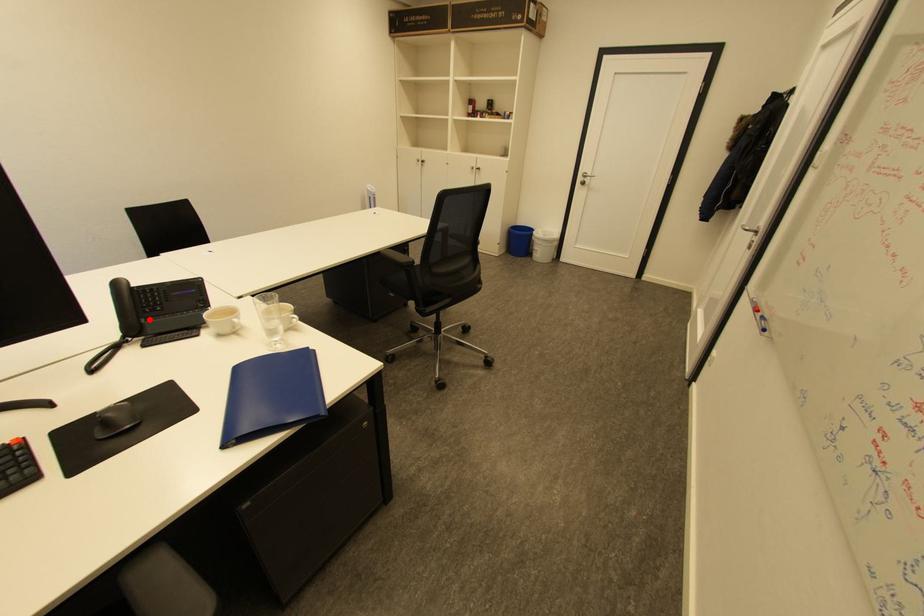
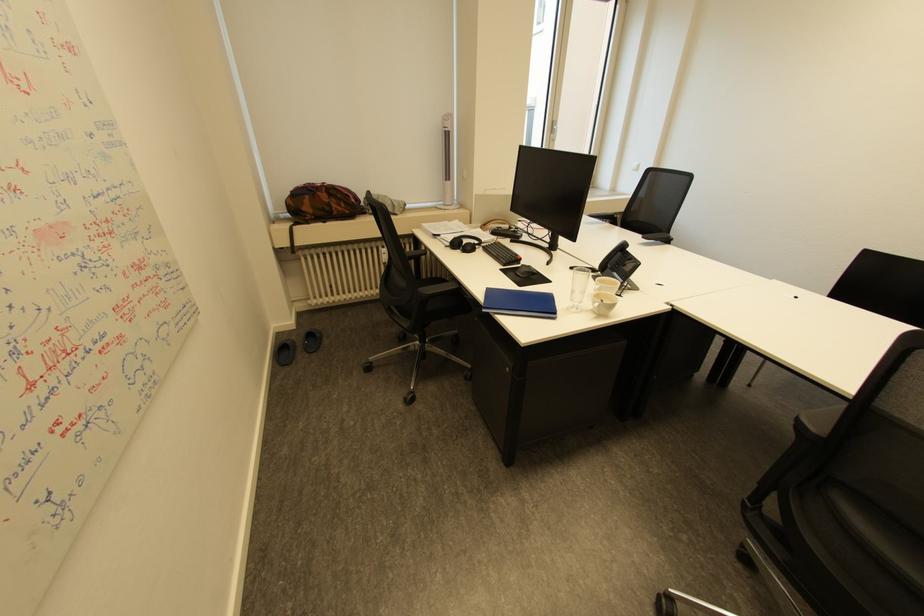
Question: I am providing you with two images of the same scene from different viewpoints. A red point is marked on the first image. At the location where the point appears in image 1, is it still visible in image 2?

Choices:
 (A) Yes
 (B) No

Answer: (A)